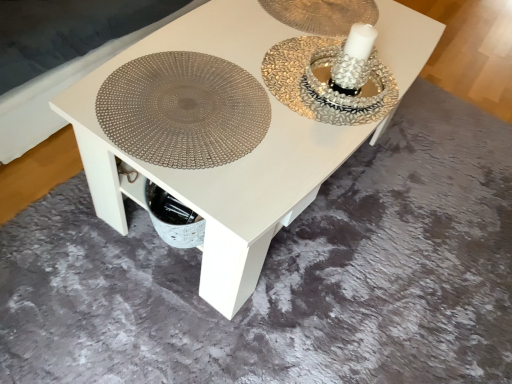
Locate an element on the screen. The width and height of the screenshot is (512, 384). vacant space to the right of white glossy table at center is located at coordinates (428, 219).